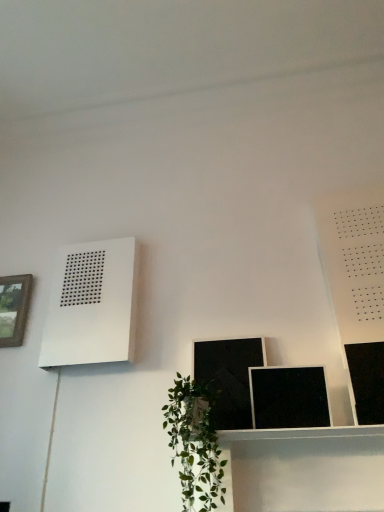
Question: From the image's perspective, is matte black picture frame at lower center, which ranks as the second picture frame in left-to-right order, located above or below black glossy picture frame at upper right, positioned as the first picture frame in right-to-left order?

Choices:
 (A) above
 (B) below

Answer: (B)

Question: Is matte black picture frame at lower center, the third picture frame when ordered from right to left, bigger or smaller than black glossy picture frame at upper right, the 1th picture frame viewed from the front?

Choices:
 (A) small
 (B) big

Answer: (A)

Question: Estimate the real-world distances between objects in this image. Which object is closer to the black matte picture frame at lower center, placed as the 3th picture frame when sorted from back to front?

Choices:
 (A) white matte air conditioner at upper left
 (B) green leafy plant at lower center
 (C) black glossy picture frame at upper right, the 1th picture frame viewed from the front
 (D) wooden framed picture at left, which is the fourth picture frame in front-to-back order
 (E) matte black picture frame at lower center, which ranks as the second picture frame in left-to-right order

Answer: (E)

Question: Which is nearer to the green leafy plant at lower center?

Choices:
 (A) black matte picture frame at lower center, which is counted as the 3th picture frame, starting from the left
 (B) black glossy picture frame at upper right, which is the fourth picture frame in left-to-right order
 (C) wooden framed picture at left, which is the fourth picture frame in front-to-back order
 (D) white matte air conditioner at upper left
 (E) matte black picture frame at lower center, the third picture frame when ordered from right to left

Answer: (E)